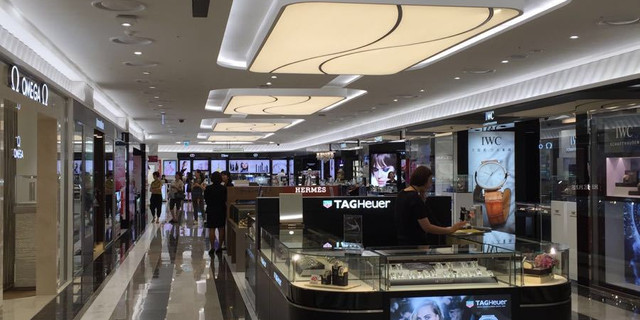
Identify the location of shiny floor. This screenshot has height=320, width=640. pos(176,291).